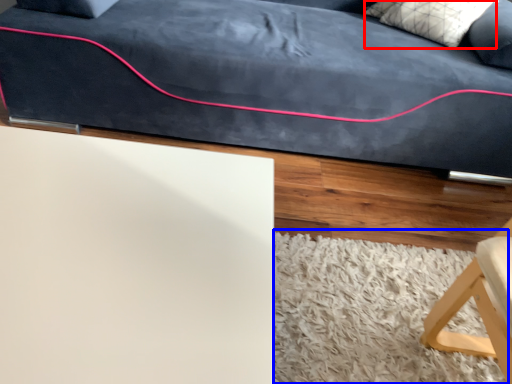
Question: Which object appears farthest to the camera in this image, pillow (highlighted by a red box) or mat (highlighted by a blue box)?

Choices:
 (A) pillow
 (B) mat

Answer: (A)